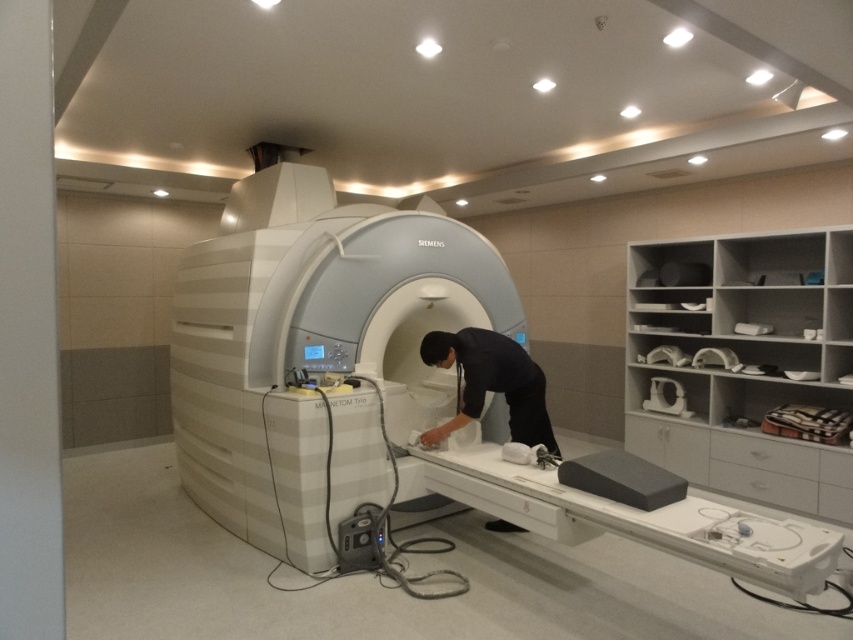
Who is taller, white plastic mri machine at center or black fabric at center?

With more height is white plastic mri machine at center.

Based on the photo, is white plastic mri machine at center above black fabric at center?

Answer: Actually, white plastic mri machine at center is below black fabric at center.

In order to click on white plastic mri machine at center in this screenshot , I will do click(358, 378).